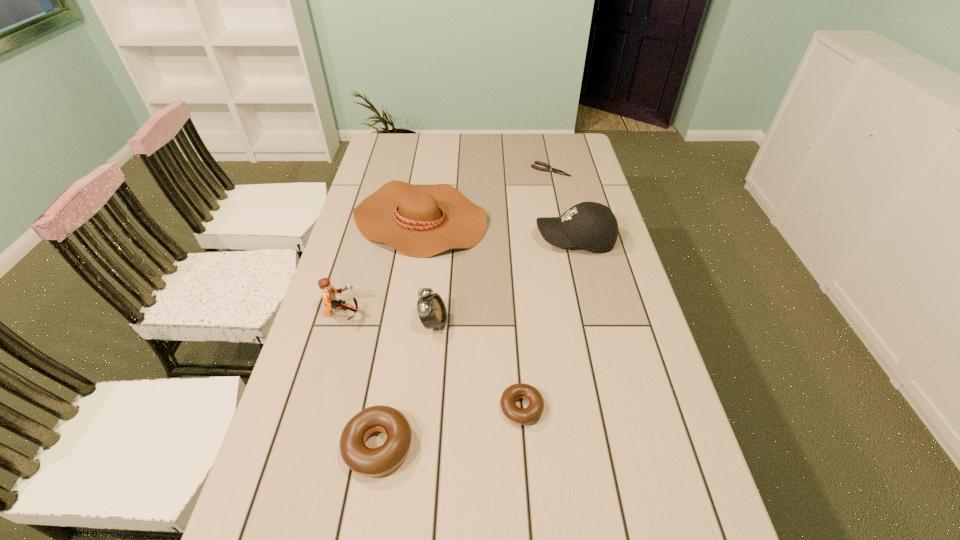
This screenshot has height=540, width=960. Find the location of `the taller doughnut`. the taller doughnut is located at coordinates (370, 462).

The image size is (960, 540). In order to click on the left doughnut in this screenshot , I will do `click(370, 462)`.

Locate an element on the screen. the sixth tallest object is located at coordinates (522, 416).

At what (x,y) coordinates should I click in order to perform the action: click on the shorter doughnut. Please return your answer as a coordinate pair (x, y). The image size is (960, 540). Looking at the image, I should click on (522, 416).

Where is `the shortest object`? The height and width of the screenshot is (540, 960). the shortest object is located at coordinates (548, 168).

The height and width of the screenshot is (540, 960). Identify the location of pliers. (548, 168).

Where is `the fourth shortest object`? the fourth shortest object is located at coordinates (420, 221).

The height and width of the screenshot is (540, 960). What are the coordinates of `alarm clock` in the screenshot? It's located at (431, 309).

Locate an element on the screen. This screenshot has width=960, height=540. baseball cap is located at coordinates (592, 226).

Locate an element on the screen. Lego is located at coordinates (329, 292).